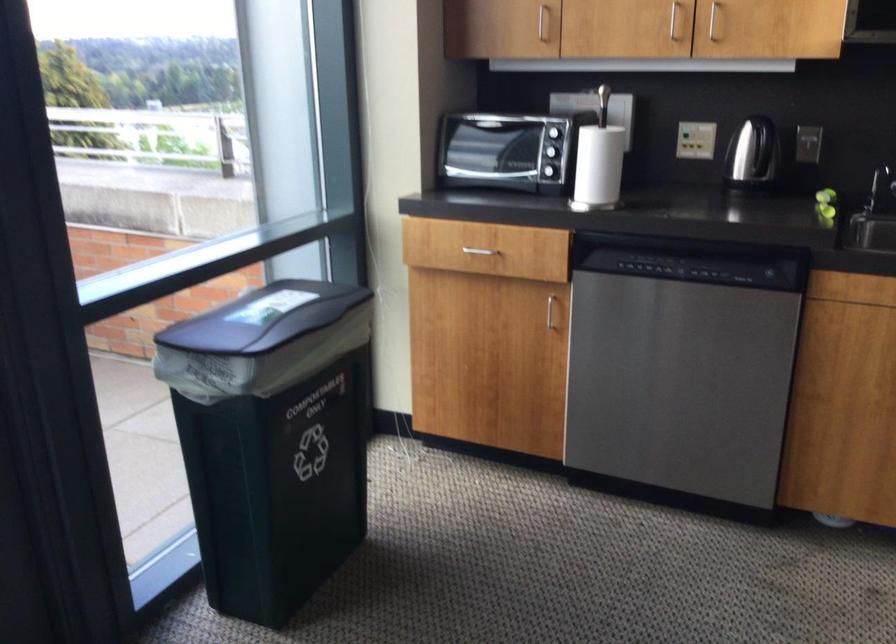
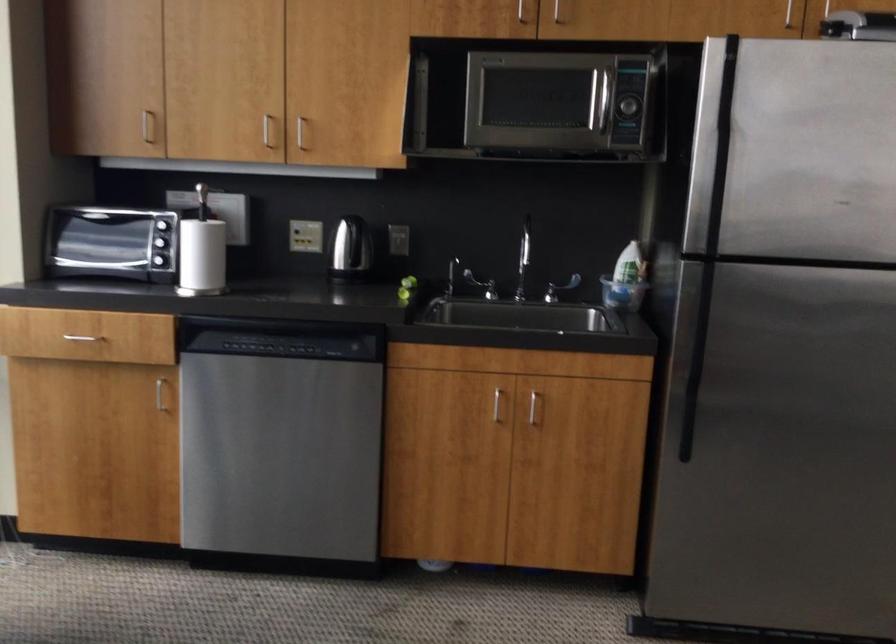
Question: The first image is from the beginning of the video and the second image is from the end. How did the camera likely rotate when shooting the video?

Choices:
 (A) Left
 (B) Right
 (C) Up
 (D) Down

Answer: (B)